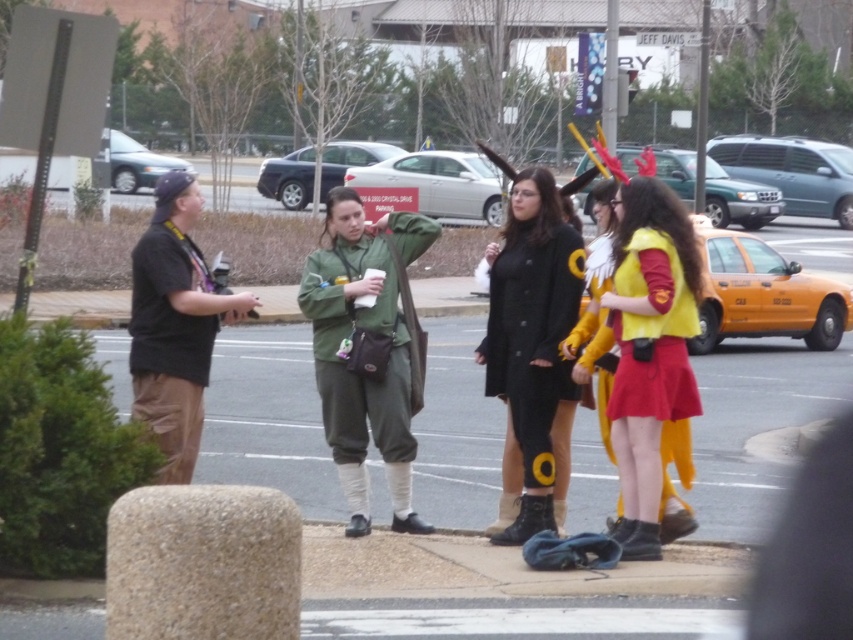
Question: Which point is farther to the camera?

Choices:
 (A) smooth asphalt pavement at center
 (B) yellow fabric costume at center
 (C) black matte coat at center
 (D) black cotton shirt at left

Answer: (A)

Question: Is green matte jacket at center wider than black matte coat at center?

Choices:
 (A) yes
 (B) no

Answer: (A)

Question: Which point is closer to the camera taking this photo?

Choices:
 (A) (563, 396)
 (B) (618, 294)

Answer: (B)

Question: Which point is closer to the camera?

Choices:
 (A) (630, 520)
 (B) (321, 294)
 (C) (160, 390)
 (D) (550, 323)

Answer: (C)

Question: Is black matte coat at center above black cotton shirt at left?

Choices:
 (A) yes
 (B) no

Answer: (B)

Question: Does black matte coat at center have a lesser width compared to black cotton shirt at left?

Choices:
 (A) no
 (B) yes

Answer: (B)